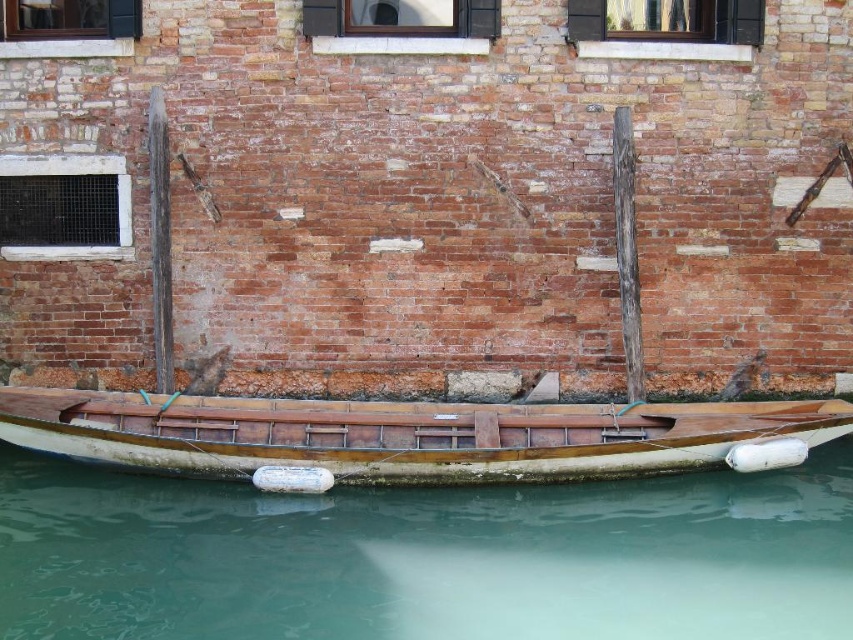
Is clear water at lower center positioned before wooden boat at lower center?

Yes, it is in front of wooden boat at lower center.

Who is more forward, (103, 536) or (181, 461)?

Point (103, 536)

Identify the location of clear water at lower center. The image size is (853, 640). (425, 556).